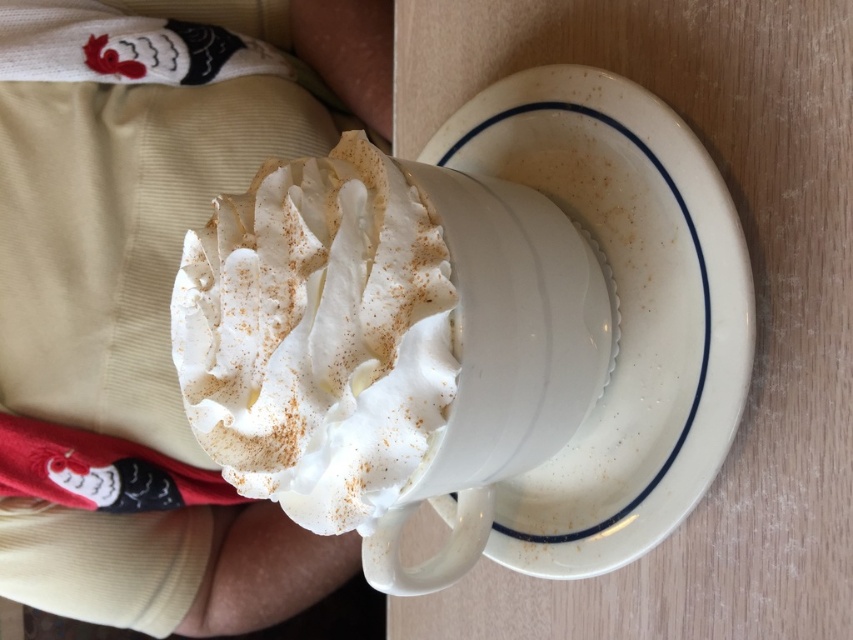
Does whipped cream at center have a larger size compared to white ceramic mug at center?

Incorrect, whipped cream at center is not larger than white ceramic mug at center.

Does whipped cream at center have a lesser height compared to white ceramic mug at center?

Yes.

Does point (408, 230) come closer to viewer compared to point (602, 353)?

Yes, point (408, 230) is in front of point (602, 353).

You are a GUI agent. You are given a task and a screenshot of the screen. Output one action in this format:
    pyautogui.click(x=<x>, y=<y>)
    Task: Click on the whipped cream at center
    Image resolution: width=853 pixels, height=640 pixels.
    Given the screenshot: What is the action you would take?
    pyautogui.click(x=317, y=333)

Does white ceramic saucer at center appear on the left side of whipped cream at center?

No, white ceramic saucer at center is not to the left of whipped cream at center.

Find the location of a particular element. white ceramic saucer at center is located at coordinates (622, 310).

Does point (561, 172) lie behind point (245, 296)?

Yes, it is behind point (245, 296).

Find the location of a particular element. The width and height of the screenshot is (853, 640). white ceramic saucer at center is located at coordinates (622, 310).

Which of these two, white ceramic saucer at center or white ceramic mug at center, stands shorter?

Standing shorter between the two is white ceramic mug at center.

Does white ceramic saucer at center have a lesser width compared to white ceramic mug at center?

No.

Is point (590, 492) in front of point (514, 333)?

No, (590, 492) is further to viewer.

In order to click on white ceramic saucer at center in this screenshot , I will do `click(622, 310)`.